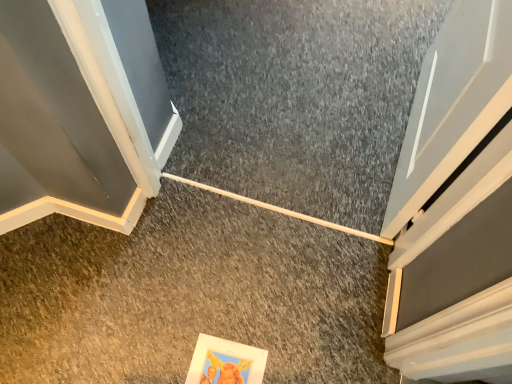
Question: From a real-world perspective, relative to gray carpet at center, the 1th concrete positioned from the front, is smooth gray carpet at center, arranged as the 1th concrete when viewed from the back, vertically above or below?

Choices:
 (A) above
 (B) below

Answer: (B)

Question: Based on their positions, is smooth gray carpet at center, arranged as the 2th concrete when viewed from the front, located to the left or right of gray carpet at center, the 1th concrete positioned from the front?

Choices:
 (A) left
 (B) right

Answer: (B)

Question: Is smooth gray carpet at center, arranged as the 1th concrete when viewed from the back, inside the boundaries of gray carpet at center, which is the second concrete in back-to-front order, or outside?

Choices:
 (A) outside
 (B) inside

Answer: (A)

Question: Is gray carpet at center, the 1th concrete positioned from the front, spatially inside smooth gray carpet at center, arranged as the 1th concrete when viewed from the back, or outside of it?

Choices:
 (A) inside
 (B) outside

Answer: (B)

Question: From the image's perspective, is gray carpet at center, the 1th concrete positioned from the front, positioned above or below smooth gray carpet at center, arranged as the 1th concrete when viewed from the back?

Choices:
 (A) below
 (B) above

Answer: (A)

Question: From a real-world perspective, is gray carpet at center, the 1th concrete positioned from the front, above or below smooth gray carpet at center, arranged as the 1th concrete when viewed from the back?

Choices:
 (A) below
 (B) above

Answer: (B)

Question: From their relative heights in the image, would you say gray carpet at center, the 1th concrete positioned from the front, is taller or shorter than smooth gray carpet at center, arranged as the 1th concrete when viewed from the back?

Choices:
 (A) tall
 (B) short

Answer: (A)